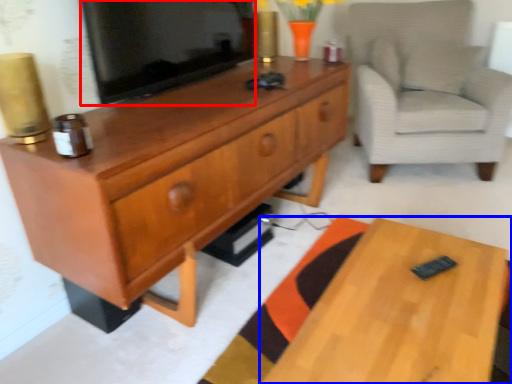
Question: Which object appears farthest to the camera in this image, television (highlighted by a red box) or desk (highlighted by a blue box)?

Choices:
 (A) television
 (B) desk

Answer: (A)